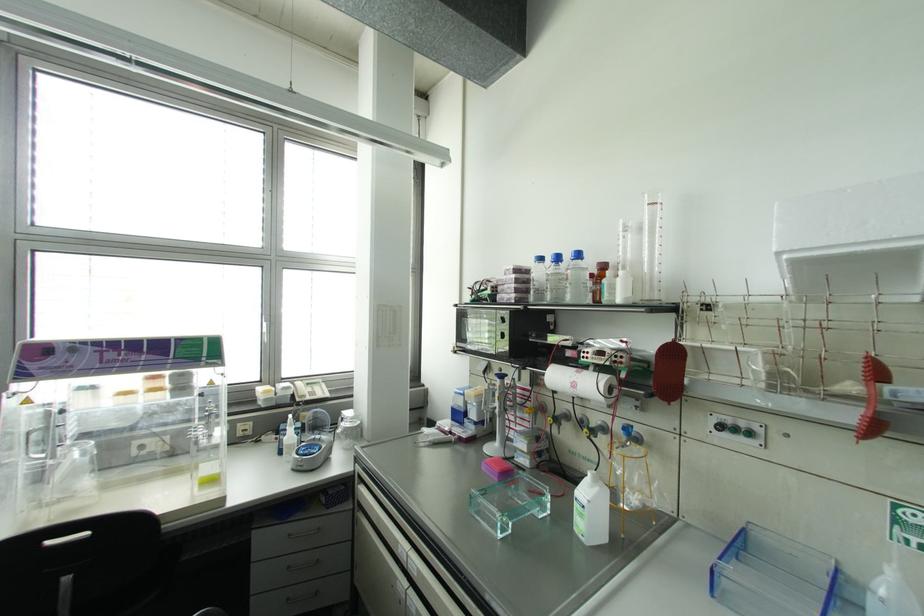
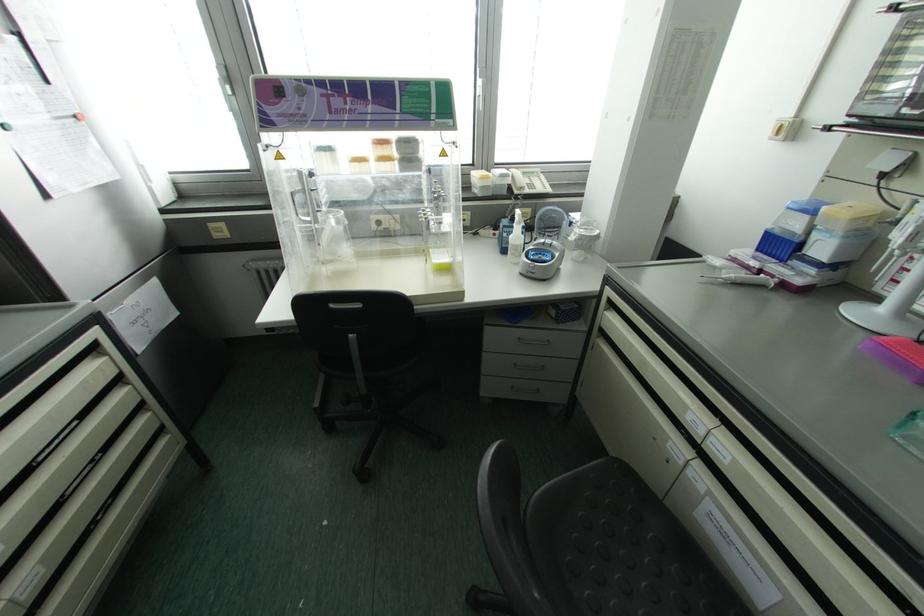
In the second image, find the point that corresponds to (x=457, y=415) in the first image.

(777, 245)